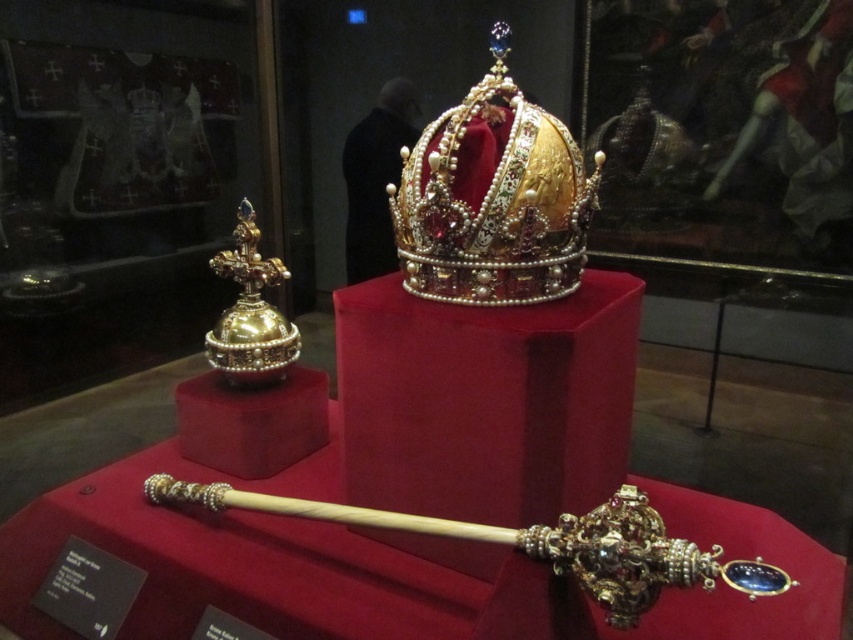
Between gold jeweled crown at center and gold polished cross at left, which one appears on the left side from the viewer's perspective?

gold polished cross at left is more to the left.

In the scene shown: Does gold jeweled crown at center appear under gold polished cross at left?

Actually, gold jeweled crown at center is above gold polished cross at left.

Is point (461, 145) less distant than point (259, 316)?

That is True.

Locate an element on the screen. The width and height of the screenshot is (853, 640). gold jeweled crown at center is located at coordinates (492, 198).